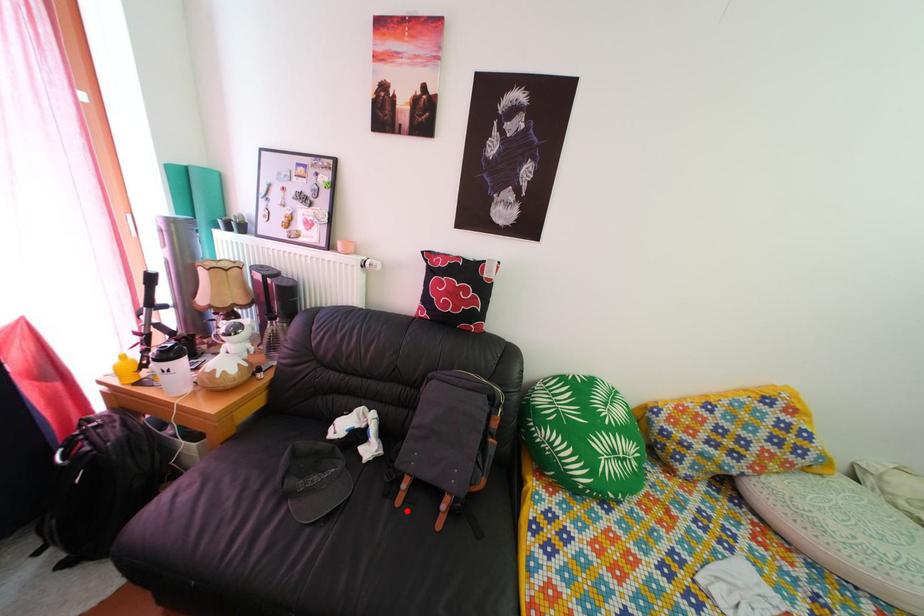
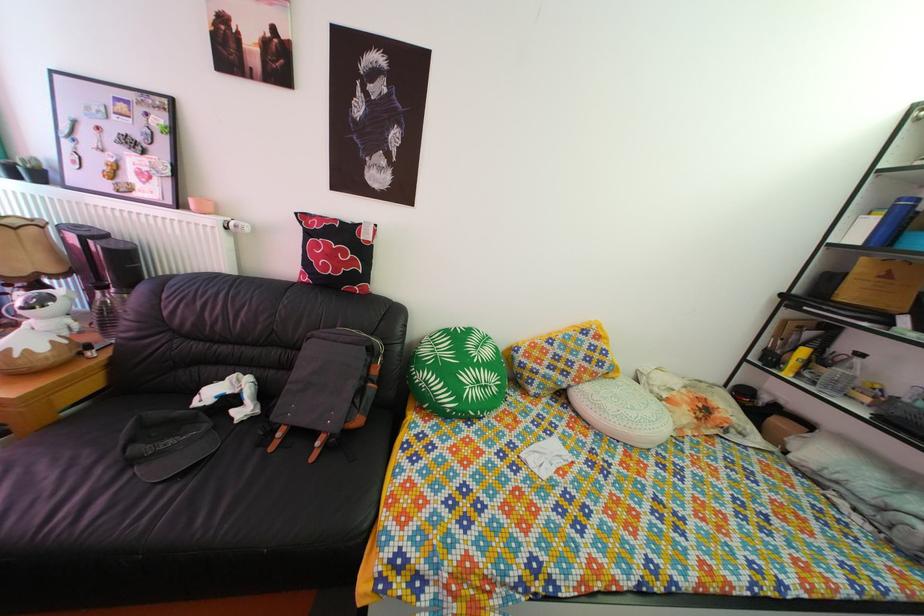
Where in the second image is the point corresponding to the highlighted location from the first image?

(281, 456)